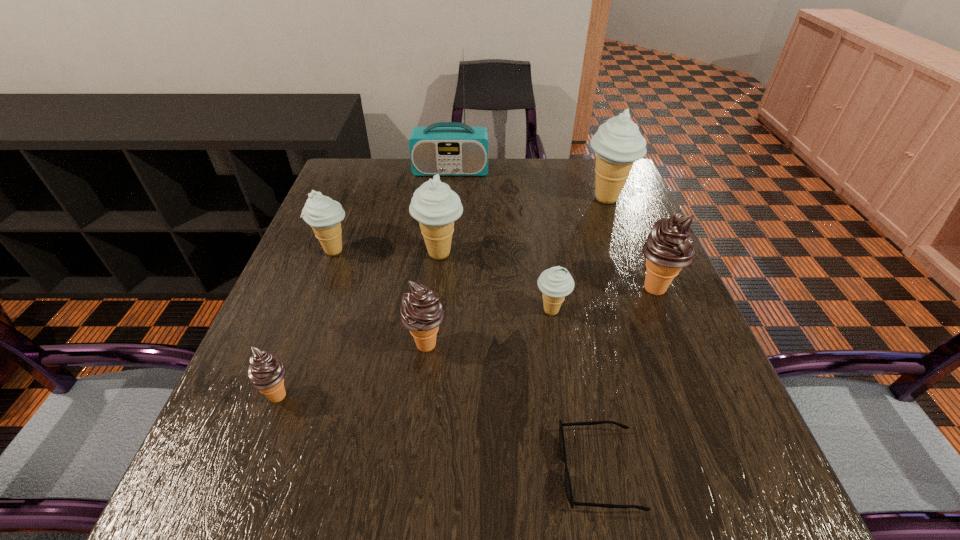
Identify the location of empty space that is in between the sunglasses and the farthest beige icecream. This screenshot has height=540, width=960. (603, 334).

Where is `free space between the second beige icecream from right to left and the eighth nearest object`? The image size is (960, 540). free space between the second beige icecream from right to left and the eighth nearest object is located at coordinates (579, 255).

Find the location of a particular element. This screenshot has height=540, width=960. free spot between the second tallest object and the third biggest beige icecream is located at coordinates (470, 225).

Where is `free point between the third beige icecream from right to left and the eighth shortest object`? free point between the third beige icecream from right to left and the eighth shortest object is located at coordinates pos(523,226).

This screenshot has height=540, width=960. Identify the location of free space between the third beige icecream from left to right and the third biggest beige icecream. (443, 281).

Where is `vacant region between the leftmost beige icecream and the eighth shortest object`? This screenshot has height=540, width=960. vacant region between the leftmost beige icecream and the eighth shortest object is located at coordinates 470,225.

Identify the location of unoccupied position between the second biggest chocolate icecream and the second beige icecream from right to left. The height and width of the screenshot is (540, 960). (489, 327).

Find the location of a particular element. The height and width of the screenshot is (540, 960). object that stands as the closest to the shortest object is located at coordinates (555, 283).

This screenshot has height=540, width=960. Identify the location of object that is the sixth closest to the third beige icecream from right to left. (266, 373).

You are a GUI agent. You are given a task and a screenshot of the screen. Output one action in this format:
    pyautogui.click(x=<x>, y=<y>)
    Task: Click on the sixth closest icecream relative to the second nearest object
    This screenshot has height=540, width=960.
    Given the screenshot: What is the action you would take?
    pyautogui.click(x=618, y=143)